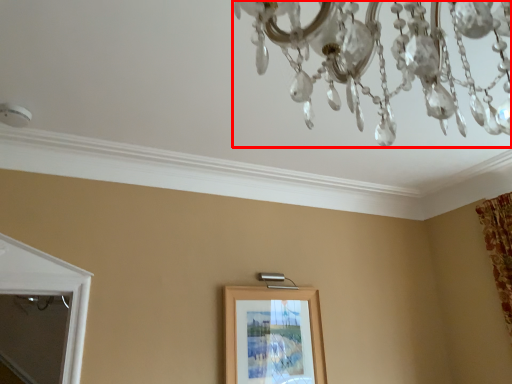
Question: In this image, where is chandelier (annotated by the red box) located relative to picture frame?

Choices:
 (A) right
 (B) left

Answer: (A)